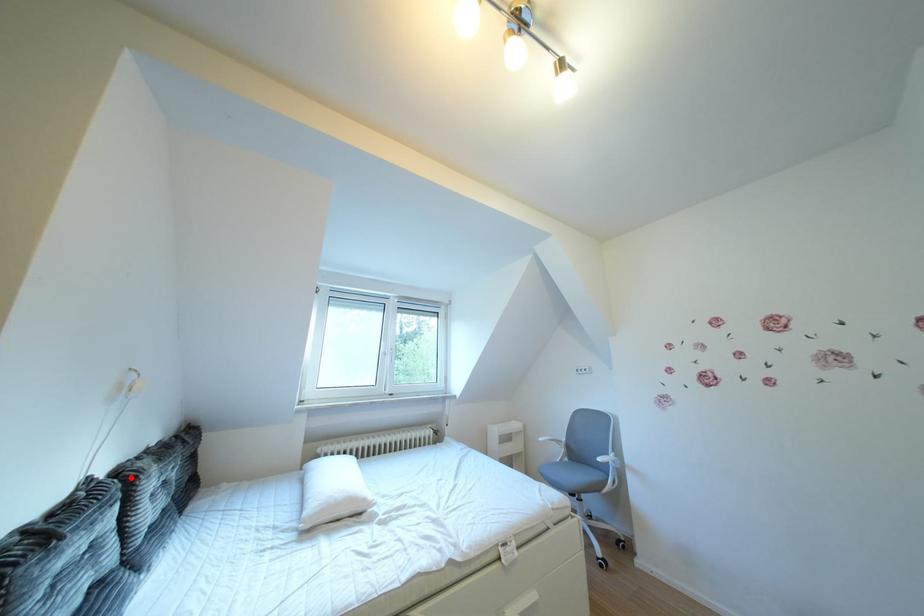
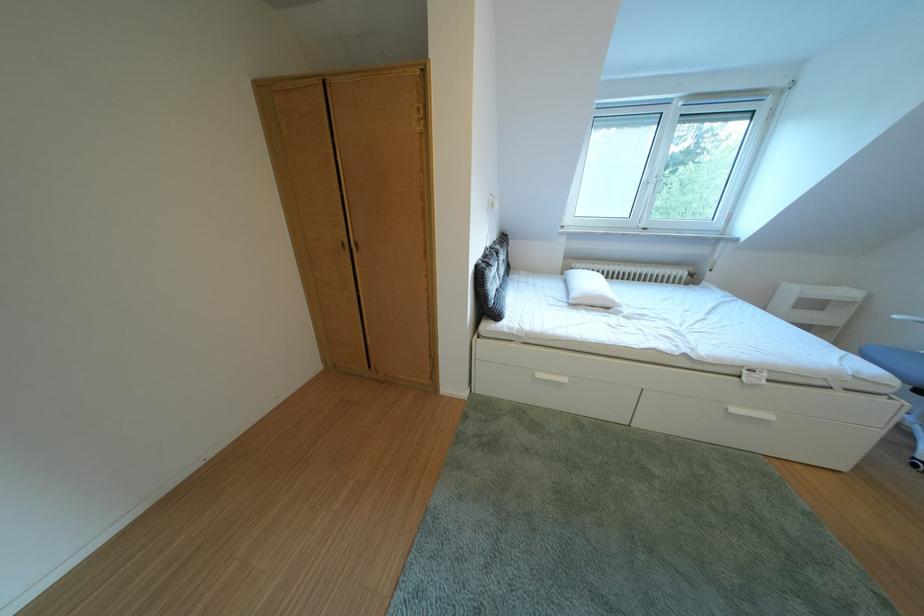
Locate, in the second image, the point that corresponds to the highlighted location in the first image.

(505, 254)